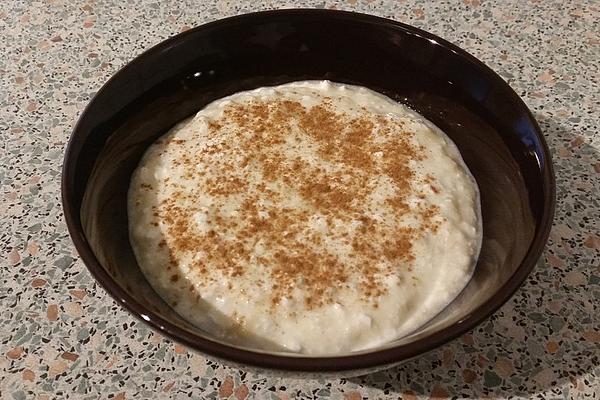
Image resolution: width=600 pixels, height=400 pixels. I want to click on countertop bottom right of bowl, so click(545, 370).